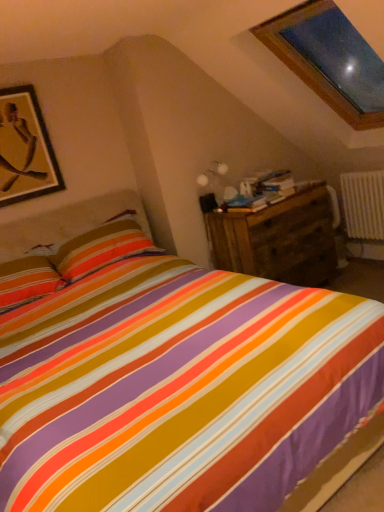
Question: Considering the positions of point (264, 209) and point (16, 102), is point (264, 209) closer or farther from the camera than point (16, 102)?

Choices:
 (A) farther
 (B) closer

Answer: (A)

Question: From a real-world perspective, is wooden chest of drawers at right positioned above or below gold matte picture frame at upper left?

Choices:
 (A) above
 (B) below

Answer: (B)

Question: Which object is the farthest from the gold matte picture frame at upper left?

Choices:
 (A) wooden chest of drawers at right
 (B) white plastic radiator at right

Answer: (B)

Question: Estimate the real-world distances between objects in this image. Which object is closer to the gold matte picture frame at upper left?

Choices:
 (A) white plastic radiator at right
 (B) wooden chest of drawers at right

Answer: (B)